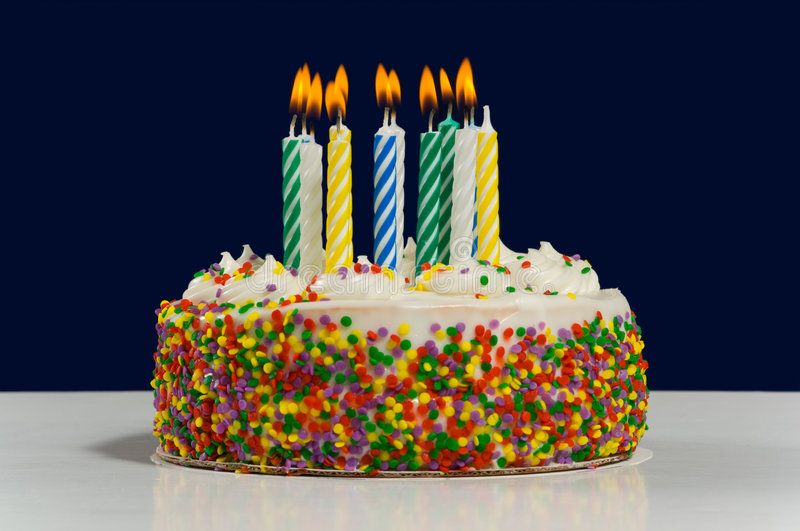
Where is `candle`? The height and width of the screenshot is (531, 800). candle is located at coordinates (489, 162), (468, 164), (449, 162), (433, 173), (398, 184), (384, 186), (345, 195), (317, 200), (286, 203).